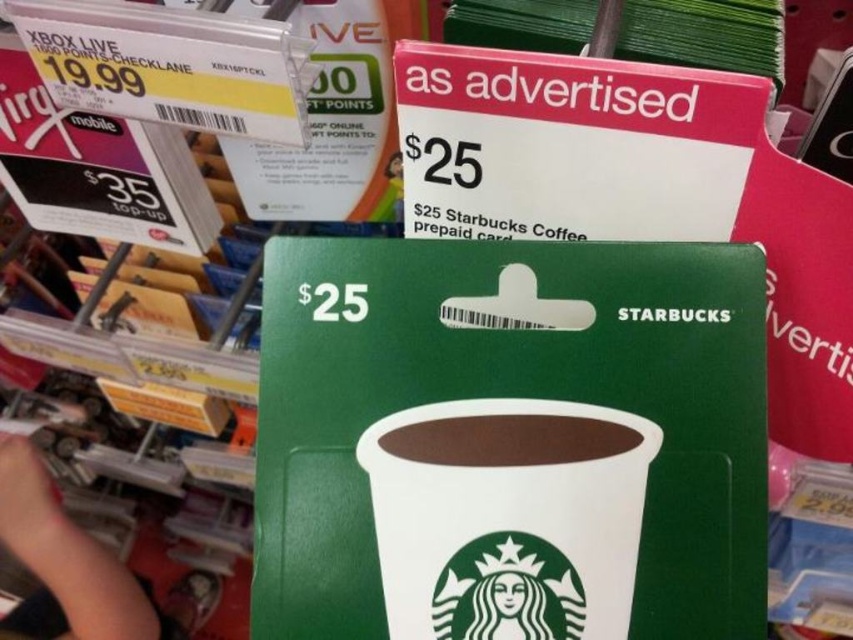
Can you confirm if green matte starbucks prepaid card at center is wider than brown matte cup at center?

Yes, green matte starbucks prepaid card at center is wider than brown matte cup at center.

Is point (740, 394) closer to viewer compared to point (461, 444)?

Yes, point (740, 394) is in front of point (461, 444).

In order to click on green matte starbucks prepaid card at center in this screenshot , I will do `click(509, 440)`.

From the picture: Which of these two, green matte starbucks prepaid card at center or white paper cup at center, stands taller?

green matte starbucks prepaid card at center

Between green matte starbucks prepaid card at center and white paper cup at center, which one is positioned lower?

white paper cup at center is below.

Where is `green matte starbucks prepaid card at center`? green matte starbucks prepaid card at center is located at coordinates (509, 440).

Locate an element on the screen. The width and height of the screenshot is (853, 640). green matte starbucks prepaid card at center is located at coordinates (509, 440).

From the picture: Who is shorter, white paper cup at center or brown matte cup at center?

brown matte cup at center

Can you confirm if white paper cup at center is wider than brown matte cup at center?

Indeed, white paper cup at center has a greater width compared to brown matte cup at center.

Does point (517, 502) come behind point (598, 435)?

No, it is not.

I want to click on white paper cup at center, so click(508, 516).